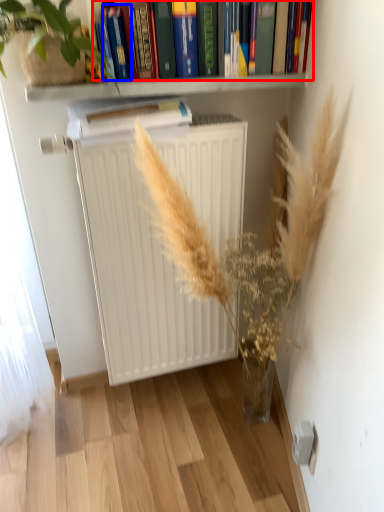
Question: Which object appears farthest to the camera in this image, book (highlighted by a red box) or paperback book (highlighted by a blue box)?

Choices:
 (A) book
 (B) paperback book

Answer: (A)